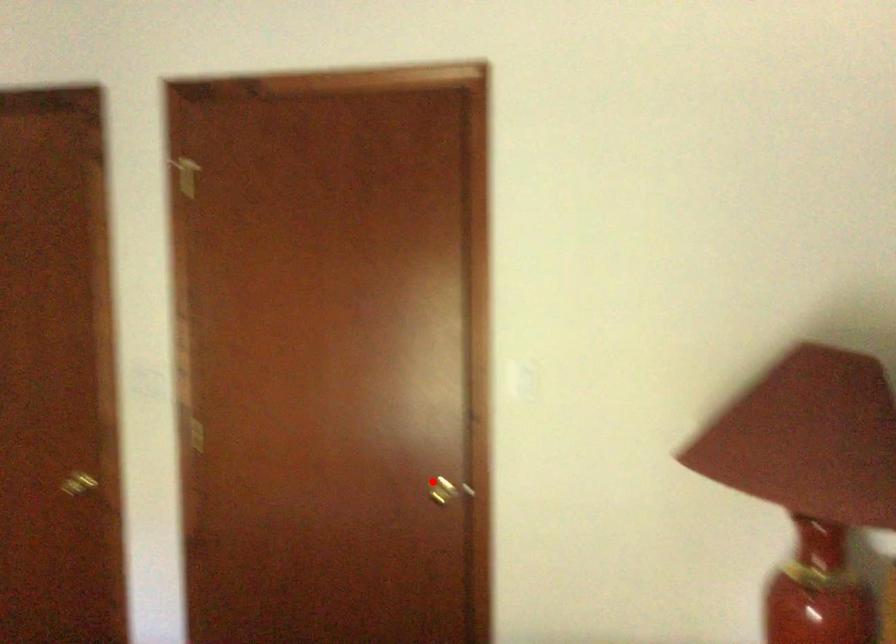
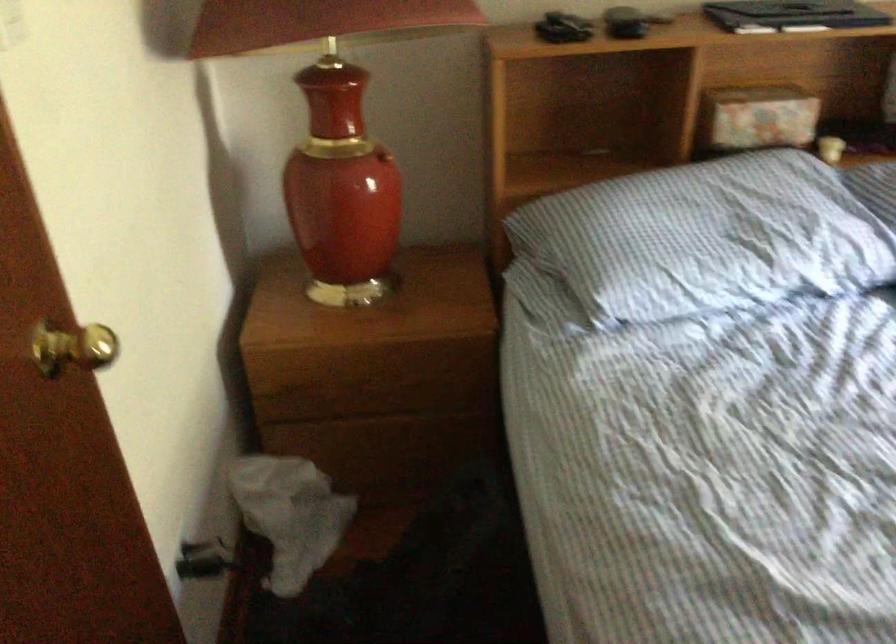
Locate, in the second image, the point that corresponds to the highlighted location in the first image.

(73, 348)